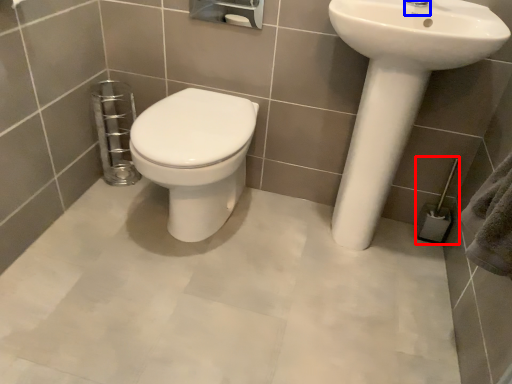
Question: Which object appears farthest to the camera in this image, towel bar (highlighted by a red box) or plumbing fixture (highlighted by a blue box)?

Choices:
 (A) towel bar
 (B) plumbing fixture

Answer: (A)